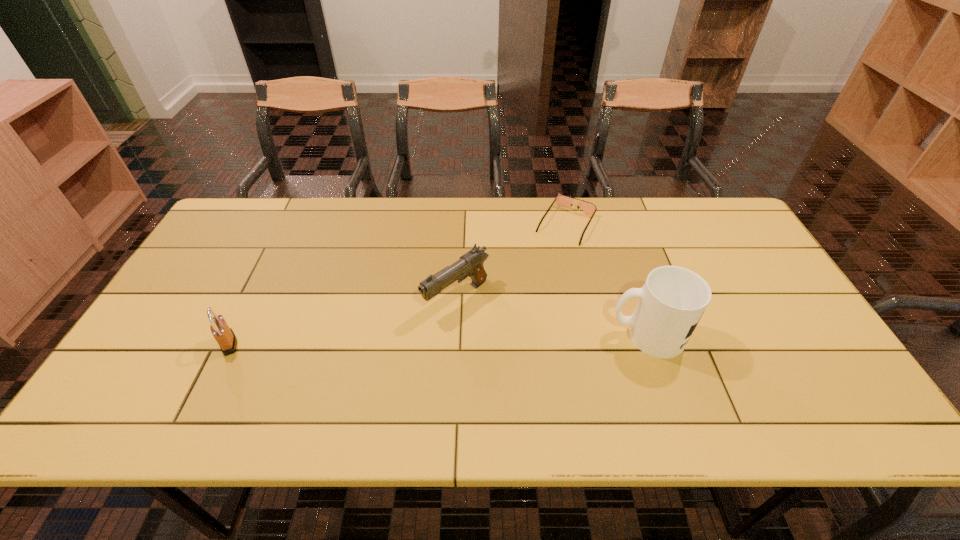
The width and height of the screenshot is (960, 540). Identify the location of the leftmost object. (225, 337).

What are the coordinates of `the tallest object` in the screenshot? It's located at (673, 299).

The height and width of the screenshot is (540, 960). What are the coordinates of `sunglasses` in the screenshot? It's located at (561, 200).

At what (x,y) coordinates should I click in order to perform the action: click on the shortest object. Please return your answer as a coordinate pair (x, y). Looking at the image, I should click on (561, 200).

In order to click on the second object from left to right in this screenshot , I will do `click(470, 264)`.

Find the location of a particular element. vacant space located on the back of the padlock is located at coordinates (256, 288).

Find the location of a particular element. free space located 0.250m on the handle side of the tallest object is located at coordinates (512, 335).

This screenshot has height=540, width=960. In order to click on free space located on the handle side of the tallest object in this screenshot , I will do `click(570, 335)`.

At what (x,y) coordinates should I click in order to perform the action: click on free spot located on the handle side of the tallest object. Please return your answer as a coordinate pair (x, y). Looking at the image, I should click on (484, 335).

The width and height of the screenshot is (960, 540). What are the coordinates of `free location located 0.120m on the bridge of the shortest object` in the screenshot? It's located at (541, 267).